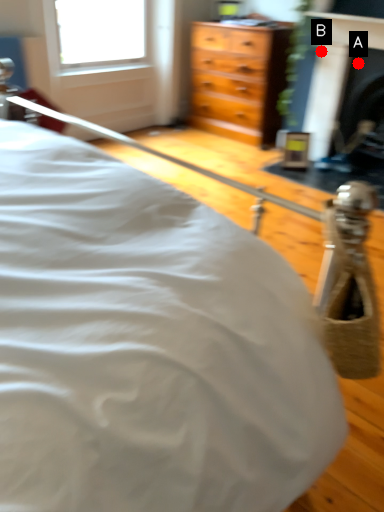
Question: Two points are circled on the image, labeled by A and B beside each circle. Among these points, which one is farthest from the camera?

Choices:
 (A) A is further
 (B) B is further

Answer: (B)